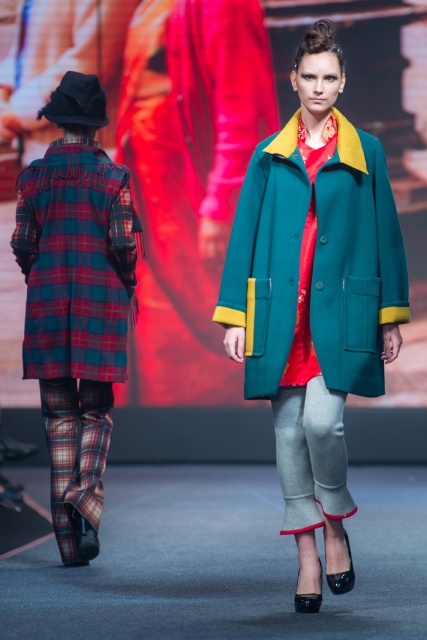
Who is higher up, plaid wool coat at left or teal woolen coat at center?

teal woolen coat at center

Can you confirm if plaid wool coat at left is positioned to the right of teal woolen coat at center?

No, plaid wool coat at left is not to the right of teal woolen coat at center.

Who is more forward, (81,225) or (386,230)?

Point (386,230) is in front.

I want to click on plaid wool coat at left, so click(76, 301).

Who is more forward, (348, 170) or (46, 276)?

Point (348, 170)

Can you confirm if teal woolen coat at center is positioned to the left of red plaid coat at back?

In fact, teal woolen coat at center is to the right of red plaid coat at back.

The height and width of the screenshot is (640, 427). What do you see at coordinates (354, 262) in the screenshot?
I see `teal woolen coat at center` at bounding box center [354, 262].

You are a GUI agent. You are given a task and a screenshot of the screen. Output one action in this format:
    pyautogui.click(x=<x>, y=<y>)
    Task: Click on the teal woolen coat at center
    
    Given the screenshot: What is the action you would take?
    pyautogui.click(x=354, y=262)

Can you confirm if plaid wool coat at left is bigger than red plaid coat at back?

Yes.

Is point (49, 237) closer to camera compared to point (131, 291)?

Yes, point (49, 237) is closer to viewer.

This screenshot has width=427, height=640. I want to click on plaid wool coat at left, so click(76, 301).